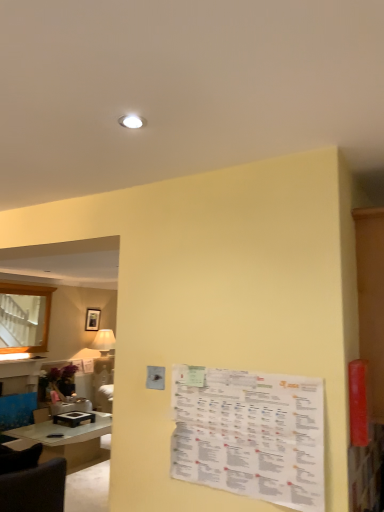
Question: From a real-world perspective, is clear glass table at lower left located beneath matte black picture frame at upper center?

Choices:
 (A) yes
 (B) no

Answer: (A)

Question: Are clear glass table at lower left and matte black picture frame at upper center making contact?

Choices:
 (A) no
 (B) yes

Answer: (A)

Question: Considering the relative positions of clear glass table at lower left and matte black picture frame at upper center in the image provided, is clear glass table at lower left in front of matte black picture frame at upper center?

Choices:
 (A) yes
 (B) no

Answer: (A)

Question: Is clear glass table at lower left aimed at matte black picture frame at upper center?

Choices:
 (A) yes
 (B) no

Answer: (B)

Question: Is clear glass table at lower left thinner than matte black picture frame at upper center?

Choices:
 (A) yes
 (B) no

Answer: (B)

Question: Is matte black picture frame at upper center situated inside white paper menu at center or outside?

Choices:
 (A) outside
 (B) inside

Answer: (A)

Question: From a real-world perspective, is matte black picture frame at upper center positioned above or below white paper menu at center?

Choices:
 (A) above
 (B) below

Answer: (A)

Question: Is matte black picture frame at upper center bigger or smaller than white paper menu at center?

Choices:
 (A) small
 (B) big

Answer: (B)

Question: Considering the relative positions of matte black picture frame at upper center and white paper menu at center in the image provided, is matte black picture frame at upper center to the left or to the right of white paper menu at center?

Choices:
 (A) right
 (B) left

Answer: (B)

Question: From the image's perspective, is white paper menu at center above or below clear glass table at lower left?

Choices:
 (A) above
 (B) below

Answer: (A)

Question: Is point (283, 409) positioned closer to the camera than point (43, 438)?

Choices:
 (A) closer
 (B) farther

Answer: (A)

Question: Is white paper menu at center to the left or to the right of clear glass table at lower left in the image?

Choices:
 (A) right
 (B) left

Answer: (A)

Question: Relative to clear glass table at lower left, is white paper menu at center in front or behind?

Choices:
 (A) behind
 (B) front

Answer: (B)

Question: From a real-world perspective, is matte black picture frame at upper center above or below clear glass table at lower left?

Choices:
 (A) above
 (B) below

Answer: (A)

Question: Considering the relative positions of matte black picture frame at upper center and clear glass table at lower left in the image provided, is matte black picture frame at upper center to the left or to the right of clear glass table at lower left?

Choices:
 (A) left
 (B) right

Answer: (A)